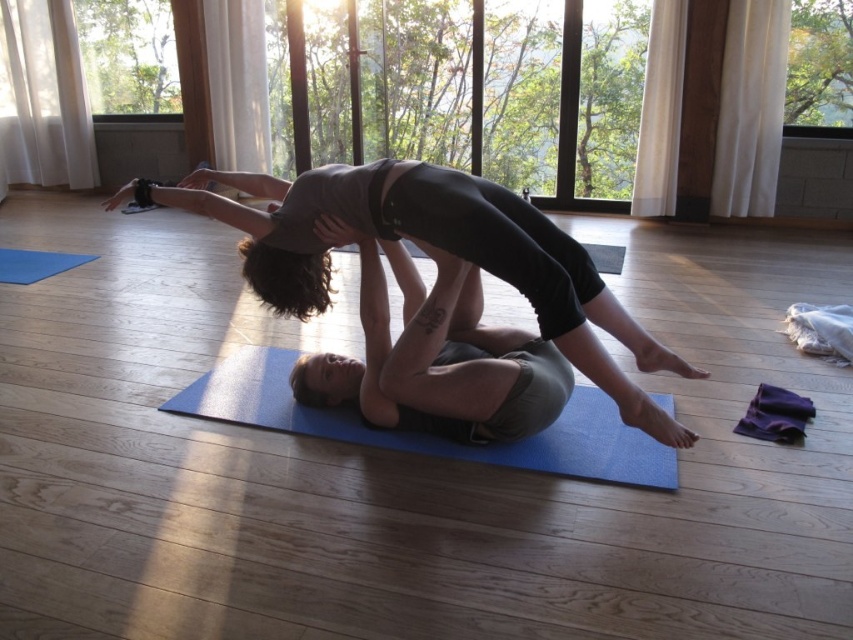
You are a photographer trying to capture the perfect shot of the acro yoga pose. You need to place a small prop exactly at the point with coordinates point (x=431, y=435). Where should you place it relative to the blue rubber yoga mat at center?

The point point (x=431, y=435) is located on the blue rubber yoga mat at center, so you should place the prop directly on the blue rubber yoga mat at center.